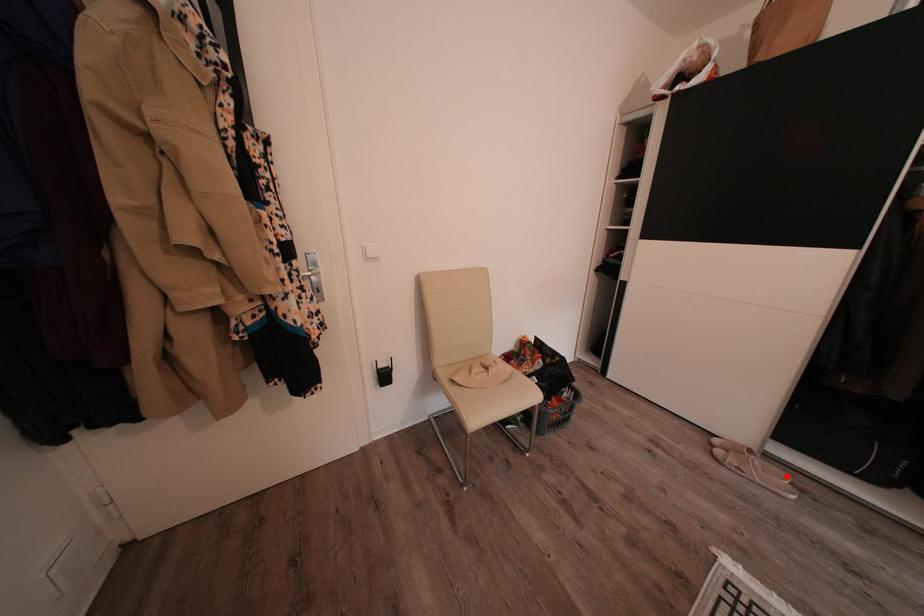
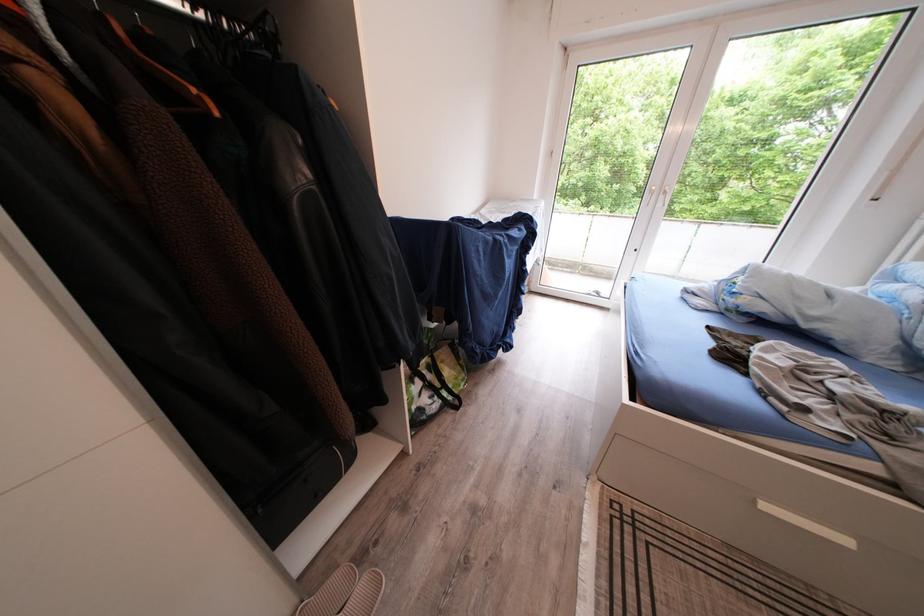
In the second image, find the point that corresponds to the highlighted location in the first image.

(347, 583)